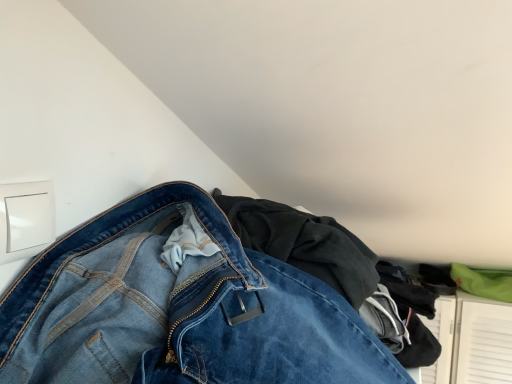
This screenshot has width=512, height=384. What do you see at coordinates (178, 307) in the screenshot? I see `denim at center` at bounding box center [178, 307].

What is the approximate width of denim at center?

It is 22.92 inches.

Where is `denim at center`? The width and height of the screenshot is (512, 384). denim at center is located at coordinates (178, 307).

Where is `denim at center`? The image size is (512, 384). denim at center is located at coordinates (178, 307).